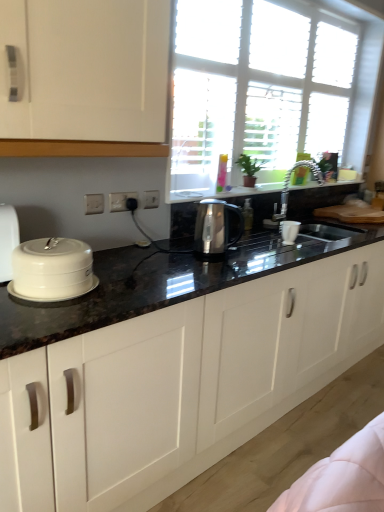
Identify the location of free space in front of white ceramic lid at left. This screenshot has width=384, height=512. (49, 316).